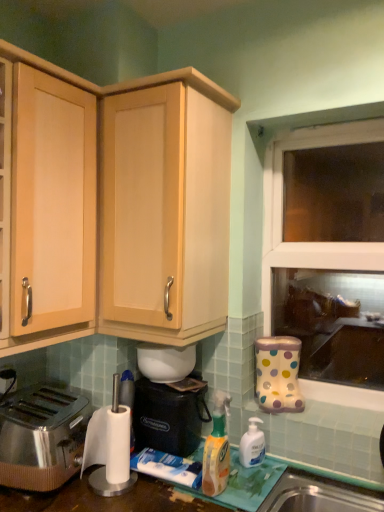
The image size is (384, 512). Identify the location of vacant area that lies in front of white translucent pump bottle at lower center, the 1th bottle viewed from the back. (251, 484).